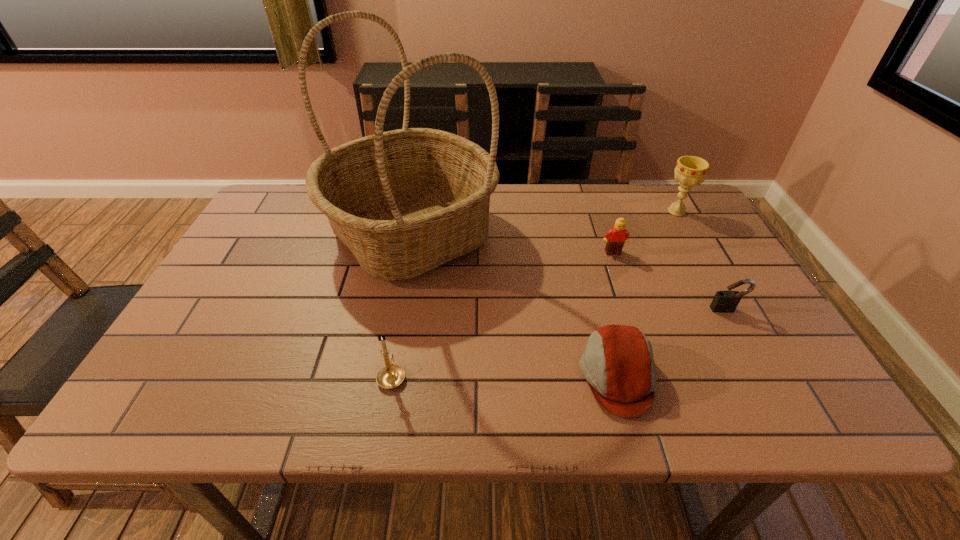
The width and height of the screenshot is (960, 540). What are the coordinates of `free space between the second tallest object and the third tallest object` in the screenshot? It's located at click(x=534, y=294).

This screenshot has width=960, height=540. Find the location of `free spot between the Lego and the tallest object`. free spot between the Lego and the tallest object is located at coordinates (513, 243).

This screenshot has width=960, height=540. Identify the location of free spot between the third tallest object and the cap. (504, 376).

At what (x,y) coordinates should I click in order to perform the action: click on free space that is in between the tallest object and the padlock. Please return your answer as a coordinate pair (x, y). The height and width of the screenshot is (540, 960). Looking at the image, I should click on (569, 272).

The width and height of the screenshot is (960, 540). What are the coordinates of `free spot between the candle holder and the cap` in the screenshot? It's located at (504, 376).

The height and width of the screenshot is (540, 960). What are the coordinates of `vacant area between the fifth shortest object and the Lego` in the screenshot? It's located at pos(645,232).

The image size is (960, 540). Identify the location of vacant space in between the Lego and the third tallest object. (502, 314).

Find the location of a particular element. This screenshot has width=960, height=540. free spot between the cap and the Lego is located at coordinates (615, 314).

The width and height of the screenshot is (960, 540). Identify the location of vacant area between the third nearest object and the third tallest object. (560, 343).

Where is `object that is the third closest to the third nearest object`? object that is the third closest to the third nearest object is located at coordinates [690, 170].